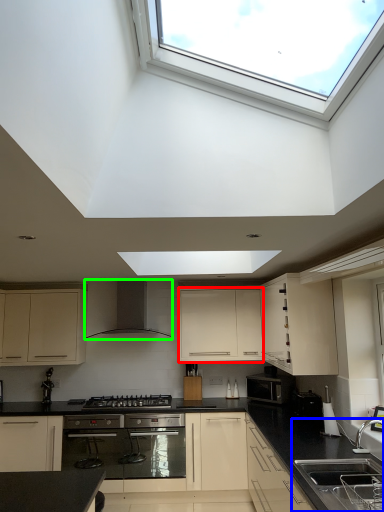
Question: Which object is positioned closest to cabinetry (highlighted by a red box)? Select from sink (highlighted by a blue box) and kitchen appliance (highlighted by a green box).

Choices:
 (A) sink
 (B) kitchen appliance

Answer: (B)